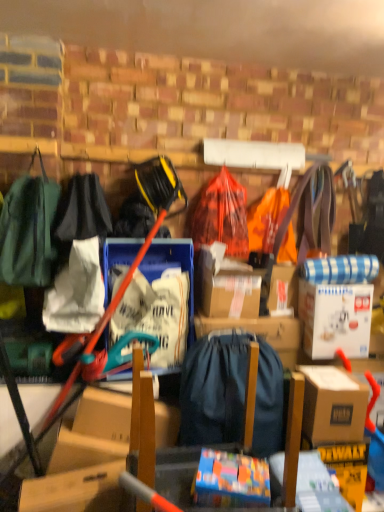
Question: Considering the relative positions of green fabric backpack at left, which is the fourth clothing in right-to-left order, and white cardboard box at upper right, which is the second box in front-to-back order, in the image provided, is green fabric backpack at left, which is the fourth clothing in right-to-left order, in front of white cardboard box at upper right, which is the second box in front-to-back order,?

Choices:
 (A) yes
 (B) no

Answer: (A)

Question: From a real-world perspective, is green fabric backpack at left, which ranks as the 1th clothing in left-to-right order, physically below white cardboard box at upper right, which is the second box in front-to-back order?

Choices:
 (A) no
 (B) yes

Answer: (A)

Question: Is green fabric backpack at left, which is the fourth clothing in right-to-left order, looking in the opposite direction of white cardboard box at upper right, which appears as the first box when viewed from the top?

Choices:
 (A) no
 (B) yes

Answer: (A)

Question: From the image's perspective, is green fabric backpack at left, which ranks as the 1th clothing in left-to-right order, beneath white cardboard box at upper right, which appears as the first box when viewed from the top?

Choices:
 (A) yes
 (B) no

Answer: (B)

Question: Does green fabric backpack at left, which is the fourth clothing in right-to-left order, have a lesser width compared to white cardboard box at upper right, which appears as the first box when viewed from the top?

Choices:
 (A) no
 (B) yes

Answer: (A)

Question: From the image's perspective, is dark blue fabric backpack at center positioned above or below green fabric backpack at left, which ranks as the 1th clothing in left-to-right order?

Choices:
 (A) below
 (B) above

Answer: (A)

Question: Relative to green fabric backpack at left, which is the fourth clothing in right-to-left order, is dark blue fabric backpack at center in front or behind?

Choices:
 (A) front
 (B) behind

Answer: (A)

Question: Looking at their shapes, would you say dark blue fabric backpack at center is wider or thinner than green fabric backpack at left, which is the fourth clothing in right-to-left order?

Choices:
 (A) thin
 (B) wide

Answer: (A)

Question: Visually, is dark blue fabric backpack at center positioned to the left or to the right of green fabric backpack at left, which is the fourth clothing in right-to-left order?

Choices:
 (A) right
 (B) left

Answer: (A)

Question: Looking at their shapes, would you say white fabric bag at center, positioned as the 2th clothing in left-to-right order, is wider or thinner than black fabric bag at left, the second clothing viewed from the right?

Choices:
 (A) thin
 (B) wide

Answer: (A)

Question: From their relative heights in the image, would you say white fabric bag at center, which is counted as the 3th clothing, starting from the right, is taller or shorter than black fabric bag at left, which is the 3th clothing in left-to-right order?

Choices:
 (A) tall
 (B) short

Answer: (B)

Question: Looking at the image, does white fabric bag at center, which is counted as the 3th clothing, starting from the right, seem bigger or smaller compared to black fabric bag at left, the second clothing viewed from the right?

Choices:
 (A) big
 (B) small

Answer: (B)

Question: Is white fabric bag at center, positioned as the 2th clothing in left-to-right order, inside or outside of black fabric bag at left, the second clothing viewed from the right?

Choices:
 (A) inside
 (B) outside

Answer: (B)

Question: From a real-world perspective, is white fabric bag at center, which is counted as the 3th clothing, starting from the right, physically located above or below green fabric backpack at left, which is the fourth clothing in right-to-left order?

Choices:
 (A) below
 (B) above

Answer: (A)

Question: Is point (84, 296) closer or farther from the camera than point (18, 280)?

Choices:
 (A) closer
 (B) farther

Answer: (B)